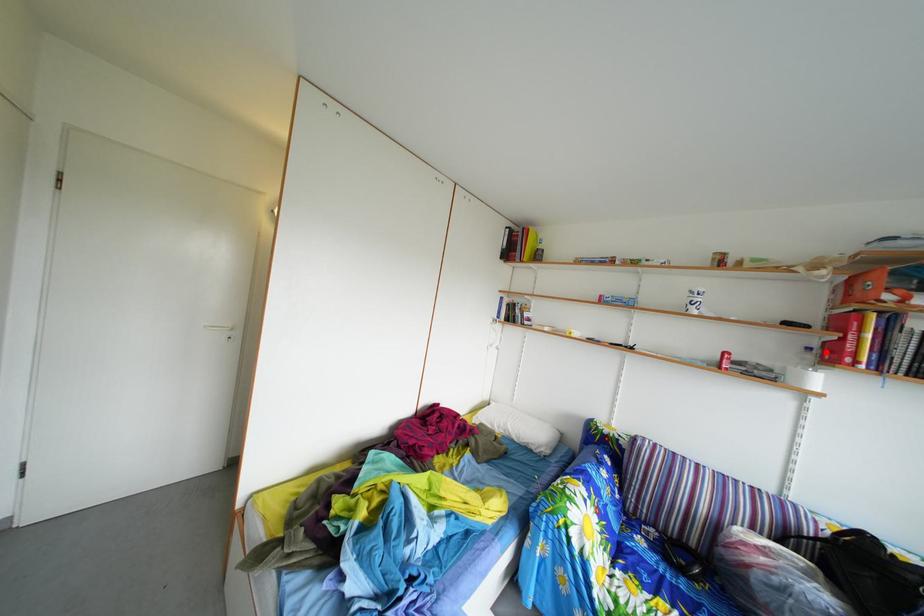
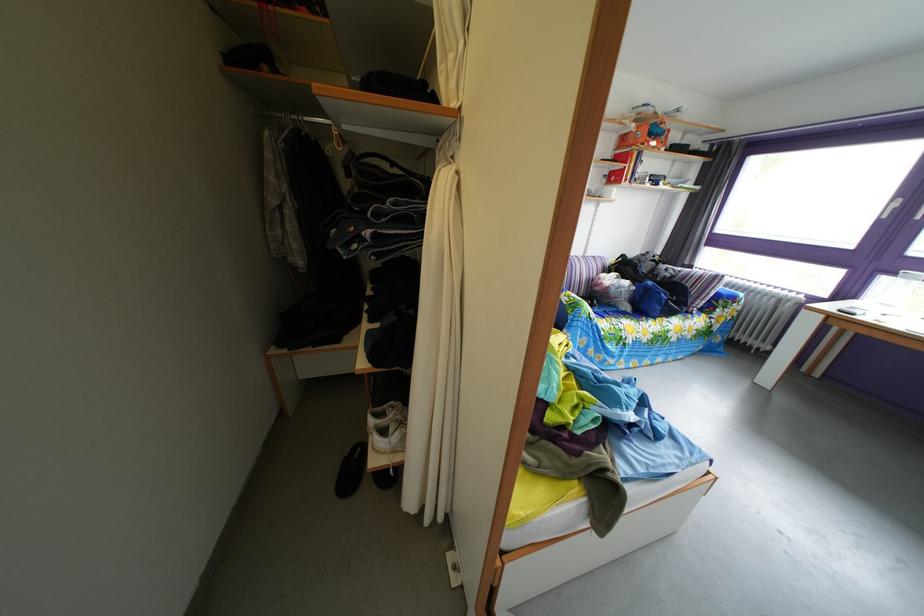
Locate, in the second image, the point that corresponds to the highlighted location in the first image.

(618, 180)